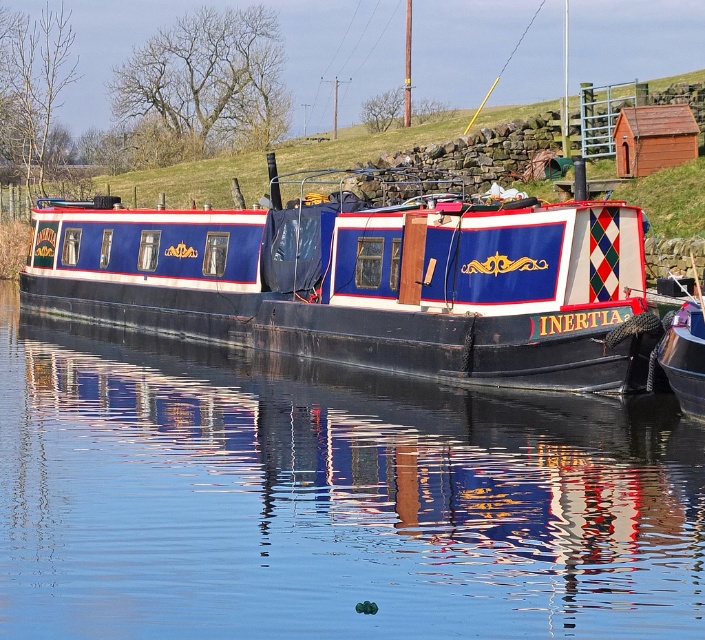
This screenshot has height=640, width=705. What do you see at coordinates (329, 499) in the screenshot?
I see `glossy black water at center` at bounding box center [329, 499].

Consider the image. Does glossy black water at center have a greater height compared to blue painted wood barge at center?

No.

The height and width of the screenshot is (640, 705). Find the location of `glossy black water at center`. glossy black water at center is located at coordinates (329, 499).